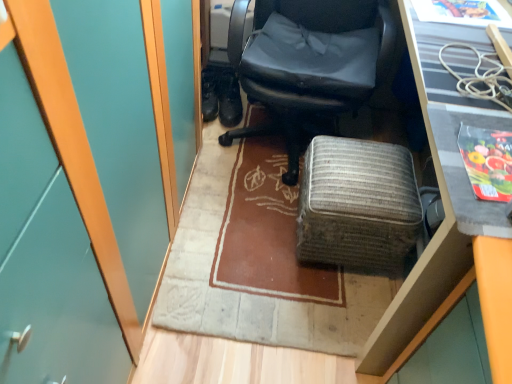
Question: Which is correct: black textured desk at upper right is inside black leather boot at center, which is the first footwear from right to left, or outside of it?

Choices:
 (A) inside
 (B) outside

Answer: (B)

Question: From the image's perspective, is black textured desk at upper right above or below black leather boot at center, acting as the second footwear starting from the left?

Choices:
 (A) below
 (B) above

Answer: (A)

Question: Which object is the closest to the black leather shoes at lower left, arranged as the 2th footwear when viewed from the right?

Choices:
 (A) woven fabric ottoman at center
 (B) black leather boot at center, acting as the second footwear starting from the left
 (C) black textured desk at upper right
 (D) matte black office chair at center

Answer: (B)

Question: Considering the real-world distances, which object is farthest from the woven fabric ottoman at center?

Choices:
 (A) black leather boot at center, acting as the second footwear starting from the left
 (B) black leather shoes at lower left, arranged as the 2th footwear when viewed from the right
 (C) black textured desk at upper right
 (D) matte black office chair at center

Answer: (B)